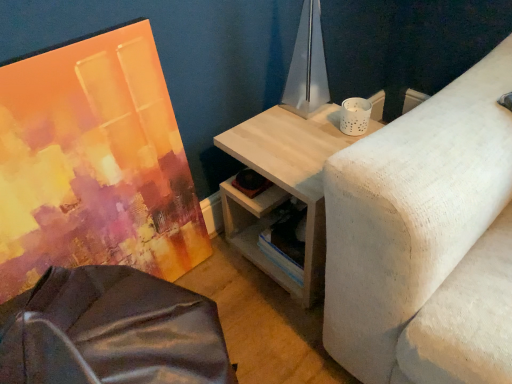
Where is `empty space that is ontop of light wood/texture side table at upper right`? The height and width of the screenshot is (384, 512). empty space that is ontop of light wood/texture side table at upper right is located at coordinates (293, 132).